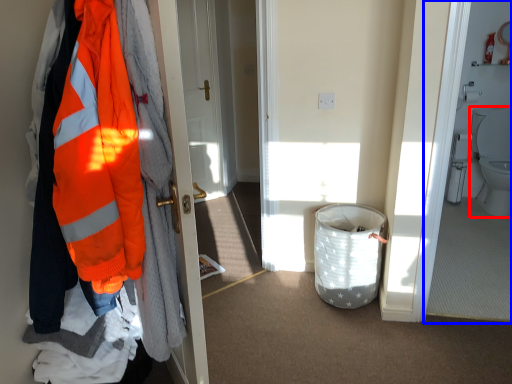
Question: Which object appears farthest to the camera in this image, toilet (highlighted by a red box) or corridor (highlighted by a blue box)?

Choices:
 (A) toilet
 (B) corridor

Answer: (A)